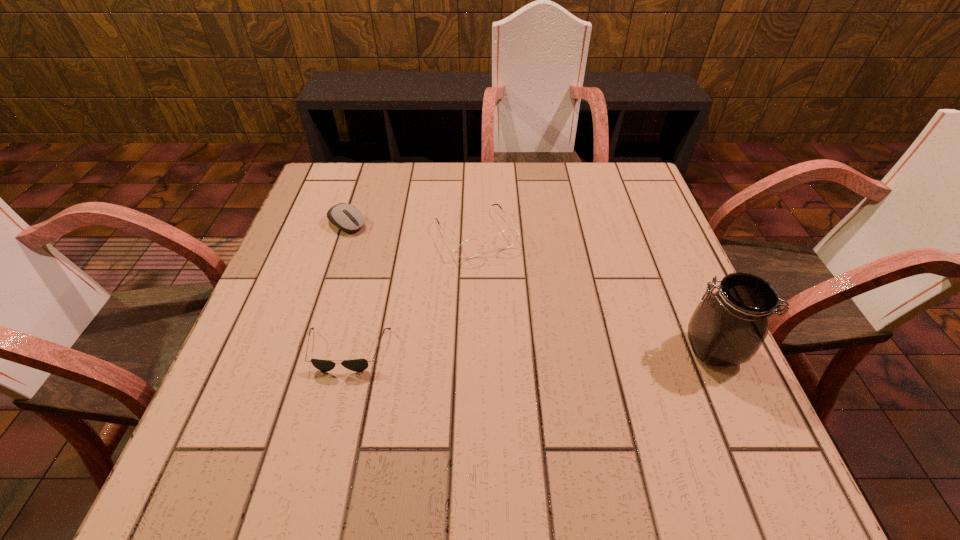
Locate an element on the screen. vacant space located on the front-facing side of the third object from left to right is located at coordinates (551, 358).

The width and height of the screenshot is (960, 540). Find the location of `free region located 0.110m on the front-facing side of the third object from left to right`. free region located 0.110m on the front-facing side of the third object from left to right is located at coordinates (512, 293).

Identify the location of free point located on the front-facing side of the third object from left to right. Image resolution: width=960 pixels, height=540 pixels. (508, 287).

Identify the location of free region located on the wheel side of the computer equipment. (424, 274).

The width and height of the screenshot is (960, 540). What are the coordinates of `vacant space located 0.170m on the wheel side of the computer equipment` in the screenshot? It's located at (406, 262).

You are a GUI agent. You are given a task and a screenshot of the screen. Output one action in this format:
    pyautogui.click(x=<x>, y=<y>)
    Task: Click on the vacant region located 0.290m on the wheel side of the computer equipment
    
    Given the screenshot: What is the action you would take?
    pyautogui.click(x=443, y=287)

Where is `spectacles situated at the far edge`? This screenshot has height=540, width=960. spectacles situated at the far edge is located at coordinates (468, 249).

At what (x,y) coordinates should I click in order to perform the action: click on computer equipment that is at the far edge. Please return your answer as a coordinate pair (x, y). Looking at the image, I should click on (348, 218).

I want to click on sunglasses that is at the left edge, so click(x=357, y=365).

You are a GUI agent. You are given a task and a screenshot of the screen. Output one action in this format:
    pyautogui.click(x=<x>, y=<y>)
    Task: Click on the computer equipment at the left edge
    
    Given the screenshot: What is the action you would take?
    pyautogui.click(x=348, y=218)